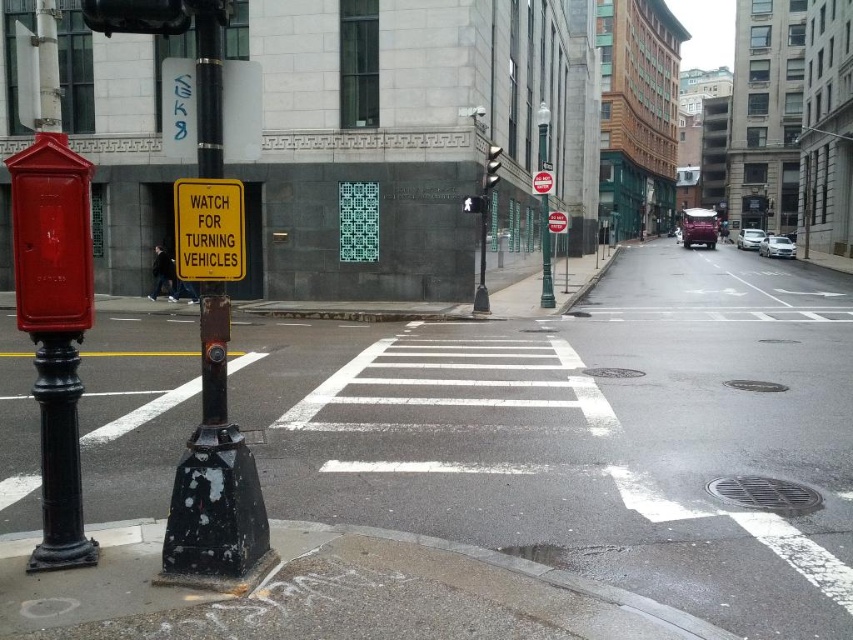
You are a pedestrian standing at the pedestrian crossing and see the yellow plastic sign at center and the metallic at center. Which one is positioned lower from the ground?

The yellow plastic sign at center is positioned lower from the ground than the metallic at center because it is below it.

You are standing at the pedestrian crossing and want to locate the green metallic pole at center. According to the coordinates given, where exactly is it positioned?

The green metallic pole at center is positioned at coordinates point (544, 253).

You are a delivery person with a 1.2 meter wide cart. You need to navigate through the space between the yellow plastic sign at center and the metallic at center on an urban street. Can your cart fit through the gap without touching either object?

The distance between the yellow plastic sign at center and the metallic at center is 10.94 meters. Since your cart is only 1.2 meters wide, there is ample space for it to pass through the gap without any issues.